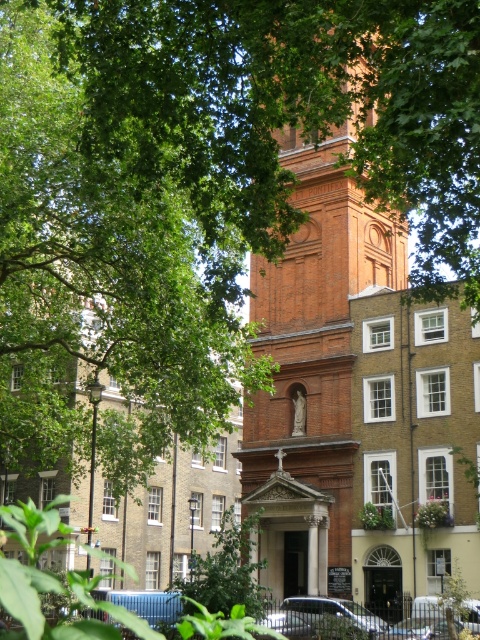
You are a delivery driver who needs to park your car in this area. You see a silver metallic car at center and a metallic silver car at lower right. Which car is blocking the other from moving out?

The silver metallic car at center is positioned under the metallic silver car at lower right, so the metallic silver car at lower right is blocking the silver metallic car at center from moving out.